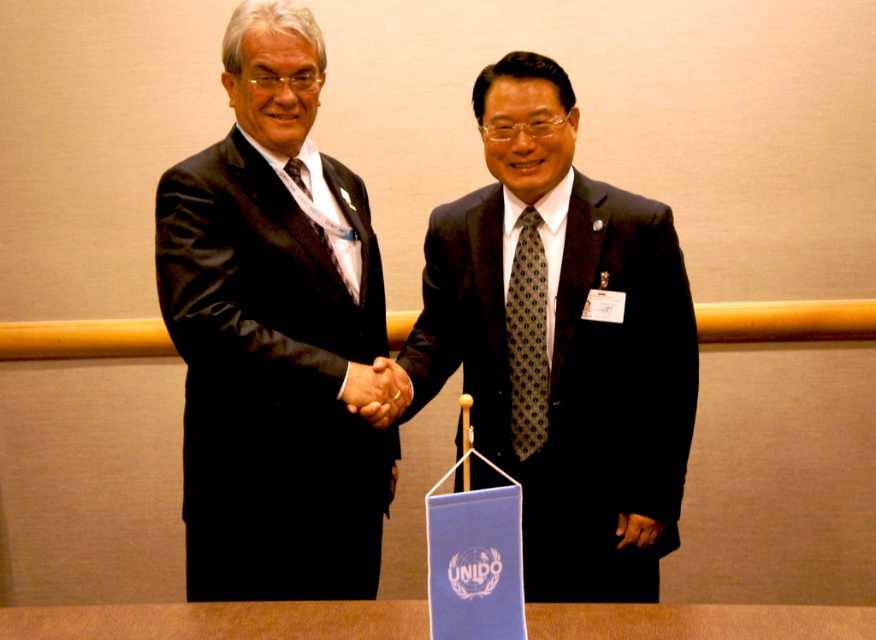
Who is taller, matte black suit at center or black leather hand at center?

Standing taller between the two is matte black suit at center.

Consider the image. Who is positioned more to the right, matte black suit at center or black leather hand at center?

matte black suit at center is more to the right.

This screenshot has height=640, width=876. What are the coordinates of `matte black suit at center` in the screenshot? It's located at (562, 342).

You are a GUI agent. You are given a task and a screenshot of the screen. Output one action in this format:
    pyautogui.click(x=<x>, y=<y>)
    Task: Click on the matte black suit at center
    
    Given the screenshot: What is the action you would take?
    pyautogui.click(x=562, y=342)

Consider the image. Is black satin suit at left to the left of brown wooden table at center from the viewer's perspective?

Yes, black satin suit at left is to the left of brown wooden table at center.

Between point (246, 557) and point (639, 627), which one is positioned behind?

Point (246, 557)

You are a GUI agent. You are given a task and a screenshot of the screen. Output one action in this format:
    pyautogui.click(x=<x>, y=<y>)
    Task: Click on the black satin suit at left
    This screenshot has height=640, width=876.
    Given the screenshot: What is the action you would take?
    click(x=274, y=333)

Does matte black suit at center appear on the right side of green dotted tie at center?

Indeed, matte black suit at center is positioned on the right side of green dotted tie at center.

Can you confirm if matte black suit at center is positioned below green dotted tie at center?

Indeed, matte black suit at center is positioned under green dotted tie at center.

Image resolution: width=876 pixels, height=640 pixels. I want to click on matte black suit at center, so click(562, 342).

Locate an element on the screen. This screenshot has height=640, width=876. matte black suit at center is located at coordinates (562, 342).